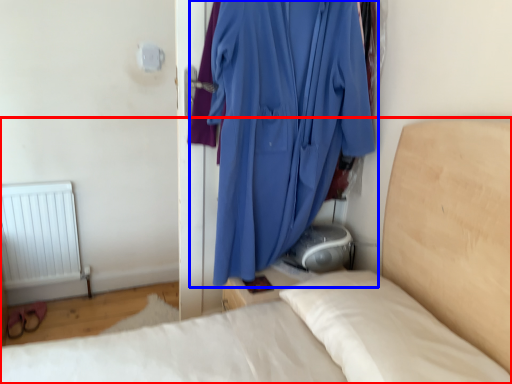
Question: Which object appears farthest to the camera in this image, bed (highlighted by a red box) or curtain (highlighted by a blue box)?

Choices:
 (A) bed
 (B) curtain

Answer: (B)